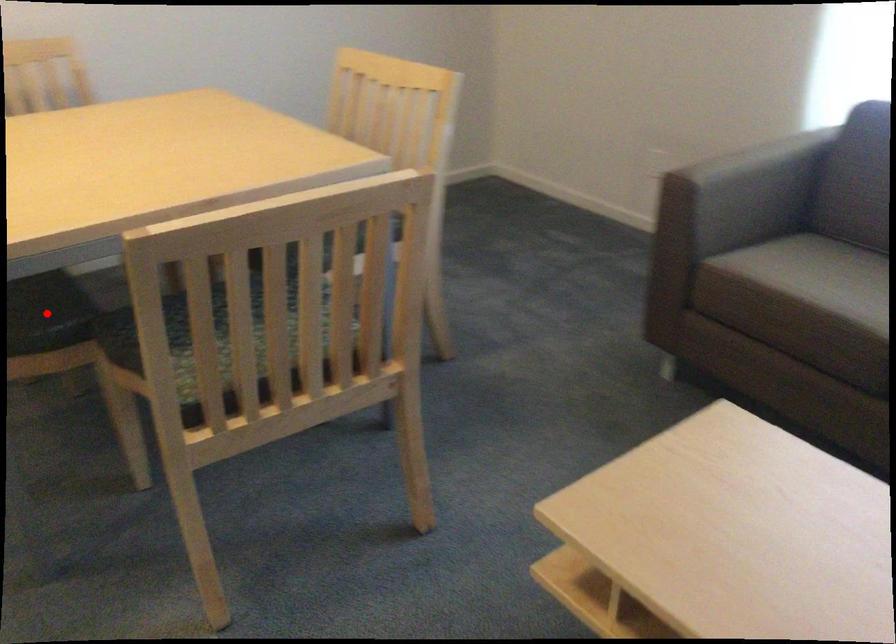
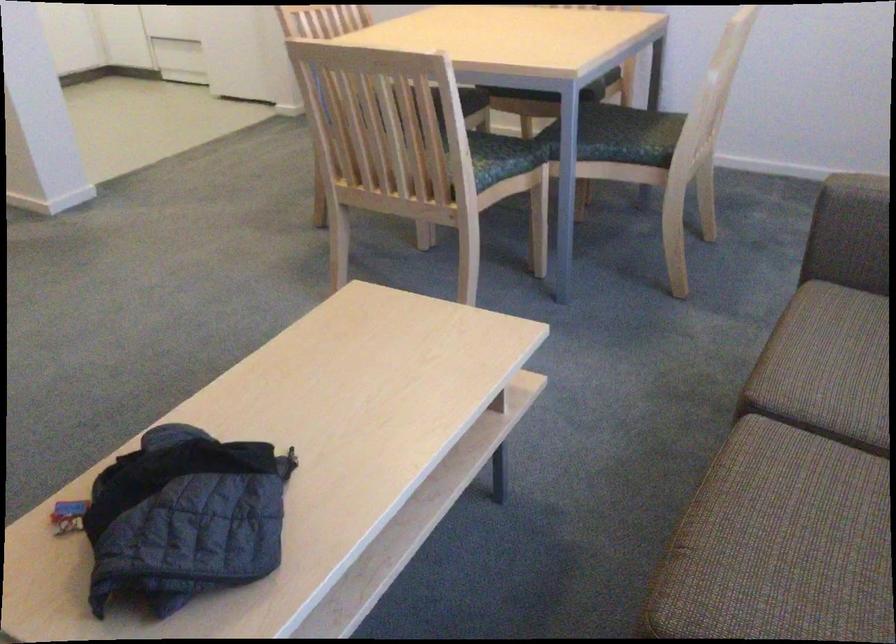
Question: I am providing you with two images of the same scene from different viewpoints. A red point is marked on the first image. At the location where the point appears in image 1, is it still visible in image 2?

Choices:
 (A) Yes
 (B) No

Answer: (B)